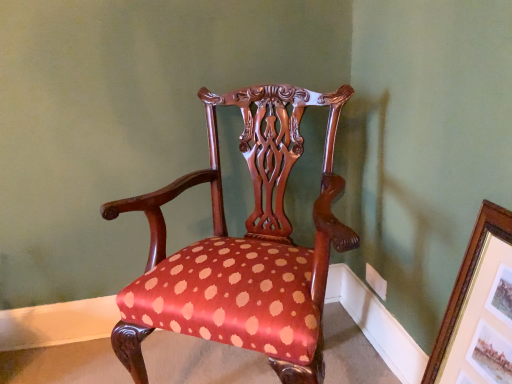
Where is `gold/gilded picture frame at upper right`? Image resolution: width=512 pixels, height=384 pixels. gold/gilded picture frame at upper right is located at coordinates (479, 309).

The width and height of the screenshot is (512, 384). What do you see at coordinates (479, 309) in the screenshot?
I see `gold/gilded picture frame at upper right` at bounding box center [479, 309].

Measure the distance between gold/gilded picture frame at upper right and camera.

gold/gilded picture frame at upper right and camera are 86.90 centimeters apart.

The image size is (512, 384). What do you see at coordinates (243, 247) in the screenshot?
I see `polished wood chair at center` at bounding box center [243, 247].

Identify the location of polished wood chair at center. This screenshot has width=512, height=384. (243, 247).

Locate an element on the screen. The image size is (512, 384). gold/gilded picture frame at upper right is located at coordinates (479, 309).

Is polished wood chair at center to the right of gold/gilded picture frame at upper right from the viewer's perspective?

No.

Considering the relative positions of polished wood chair at center and gold/gilded picture frame at upper right in the image provided, is polished wood chair at center in front of gold/gilded picture frame at upper right?

No, polished wood chair at center is further to the viewer.

Is point (258, 350) positioned before point (473, 339)?

No, (258, 350) is further to viewer.

From the image's perspective, is polished wood chair at center located beneath gold/gilded picture frame at upper right?

No.

Based on the photo, from a real-world perspective, between polished wood chair at center and gold/gilded picture frame at upper right, who is vertically lower?

gold/gilded picture frame at upper right.

Does polished wood chair at center have a greater width compared to gold/gilded picture frame at upper right?

Correct, the width of polished wood chair at center exceeds that of gold/gilded picture frame at upper right.

In the scene shown: Is polished wood chair at center taller or shorter than gold/gilded picture frame at upper right?

Clearly, polished wood chair at center is taller compared to gold/gilded picture frame at upper right.

Who is smaller, polished wood chair at center or gold/gilded picture frame at upper right?

gold/gilded picture frame at upper right.

Could gold/gilded picture frame at upper right be considered to be inside polished wood chair at center?

That's incorrect, gold/gilded picture frame at upper right is not inside polished wood chair at center.

Is polished wood chair at center with gold/gilded picture frame at upper right?

polished wood chair at center and gold/gilded picture frame at upper right are not in contact.

Could you tell me if polished wood chair at center is turned towards gold/gilded picture frame at upper right?

No, polished wood chair at center is not facing towards gold/gilded picture frame at upper right.

Locate an element on the screen. The width and height of the screenshot is (512, 384). picture frame that is below the polished wood chair at center (from the image's perspective) is located at coordinates (479, 309).

Can you confirm if gold/gilded picture frame at upper right is positioned to the left of polished wood chair at center?

In fact, gold/gilded picture frame at upper right is to the right of polished wood chair at center.

Is the position of gold/gilded picture frame at upper right less distant than that of polished wood chair at center?

That is True.

Is point (485, 304) farther from viewer compared to point (205, 104)?

No, (485, 304) is in front of (205, 104).

From the image's perspective, would you say gold/gilded picture frame at upper right is positioned over polished wood chair at center?

No, from the image's perspective, gold/gilded picture frame at upper right is not on top of polished wood chair at center.

From a real-world perspective, relative to polished wood chair at center, is gold/gilded picture frame at upper right vertically above or below?

From a real-world perspective, gold/gilded picture frame at upper right is physically below polished wood chair at center.

Does gold/gilded picture frame at upper right have a greater width compared to polished wood chair at center?

Incorrect, the width of gold/gilded picture frame at upper right does not surpass that of polished wood chair at center.

Who is taller, gold/gilded picture frame at upper right or polished wood chair at center?

With more height is polished wood chair at center.

Can you confirm if gold/gilded picture frame at upper right is smaller than polished wood chair at center?

Yes, gold/gilded picture frame at upper right is smaller than polished wood chair at center.

Is gold/gilded picture frame at upper right inside or outside of polished wood chair at center?

gold/gilded picture frame at upper right is not inside polished wood chair at center, it's outside.

Is gold/gilded picture frame at upper right far from polished wood chair at center?

gold/gilded picture frame at upper right is actually quite close to polished wood chair at center.

Is gold/gilded picture frame at upper right oriented towards polished wood chair at center?

Yes, gold/gilded picture frame at upper right is facing polished wood chair at center.

Measure the distance between gold/gilded picture frame at upper right and polished wood chair at center.

A distance of 20.05 inches exists between gold/gilded picture frame at upper right and polished wood chair at center.

The image size is (512, 384). I want to click on picture frame that appears on the right of polished wood chair at center, so click(479, 309).

This screenshot has width=512, height=384. Find the location of `chair above the gold/gilded picture frame at upper right (from the image's perspective)`. chair above the gold/gilded picture frame at upper right (from the image's perspective) is located at coordinates (243, 247).

In order to click on chair behind the gold/gilded picture frame at upper right in this screenshot , I will do pos(243,247).